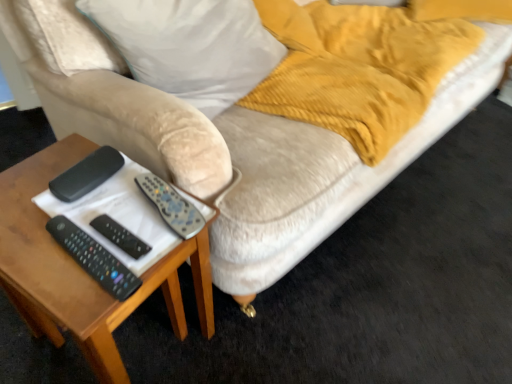
Identify the location of free space to the left of black plastic remote control at left. (36, 178).